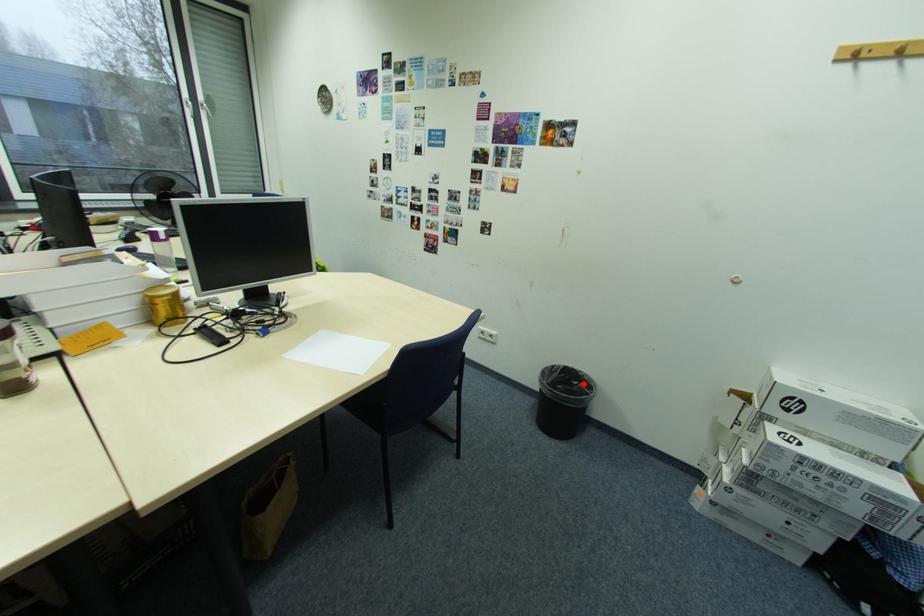
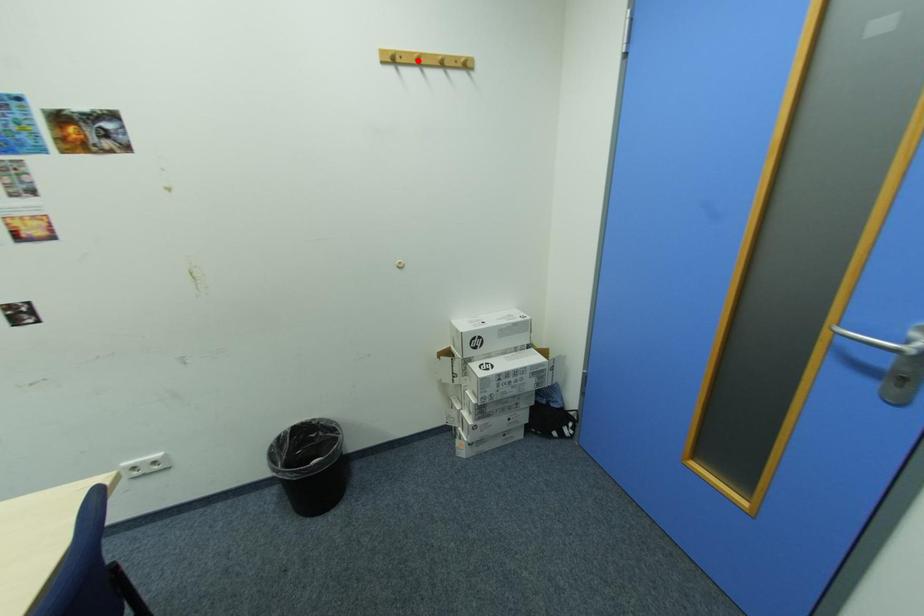
I am providing you with two images of the same scene from different viewpoints. A red point is marked on the first image and another point is marked on the second image. Is the marked point in image1 the same physical position as the marked point in image2?

No